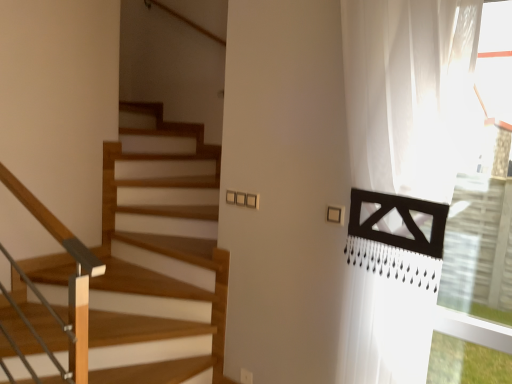
Describe the element at coordinates (408, 92) in the screenshot. I see `white sheer curtain at right` at that location.

This screenshot has width=512, height=384. Identify the location of white sheer curtain at right. (408, 92).

What is the approximate width of white sheer curtain at right?

white sheer curtain at right is 5.15 inches in width.

In order to click on white sheer curtain at right in this screenshot , I will do `click(408, 92)`.